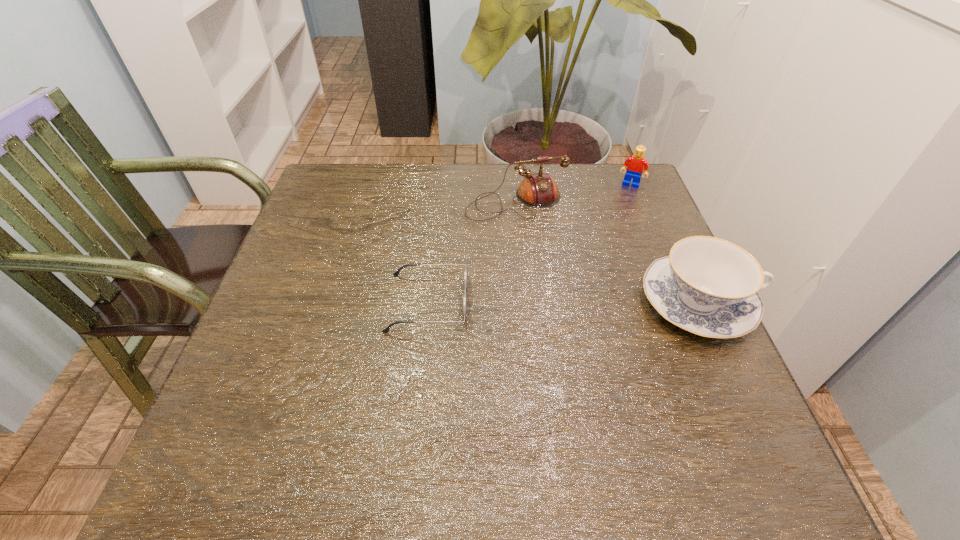
Where is `vacant spot on the desktop that is between the shortest object and the chinaware and is positioned on the rotary dial of the telephone`? vacant spot on the desktop that is between the shortest object and the chinaware and is positioned on the rotary dial of the telephone is located at coordinates (565, 303).

This screenshot has height=540, width=960. I want to click on vacant space on the desktop that is between the sunglasses and the chinaware and is positioned on the front-facing side of the Lego, so click(x=588, y=303).